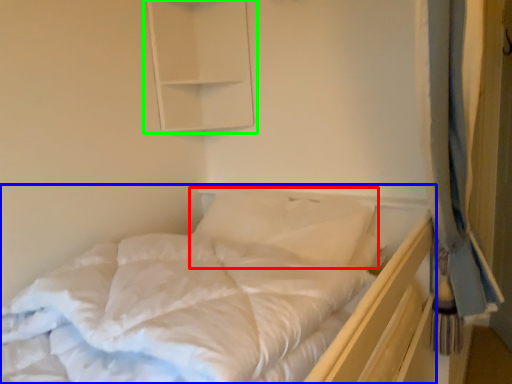
Question: Based on their relative distances, which object is farther from pillow (highlighted by a red box)? Choose from bed (highlighted by a blue box) and medicine cabinet (highlighted by a green box).

Choices:
 (A) bed
 (B) medicine cabinet

Answer: (B)